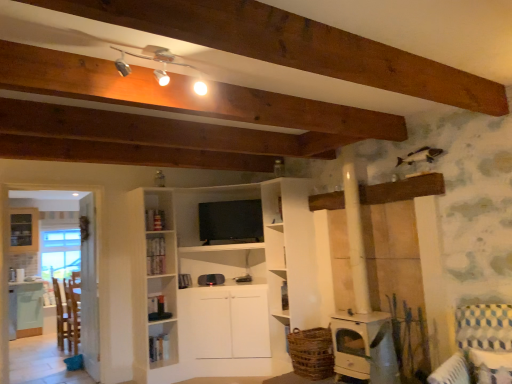
Question: Would you say wooden chair at left is inside or outside silver metallic track lights at upper center?

Choices:
 (A) inside
 (B) outside

Answer: (B)

Question: Looking at the image, does wooden chair at left seem bigger or smaller compared to silver metallic track lights at upper center?

Choices:
 (A) big
 (B) small

Answer: (A)

Question: Which object is positioned closest to the blue and white checkered fabric armchair at lower right?

Choices:
 (A) white matte wood stove at lower center
 (B) wooden chair at left
 (C) green matte table at lower left
 (D) transparent glass door at left
 (E) silver metallic track lights at upper center

Answer: (A)

Question: Which of these objects is positioned closest to the green matte table at lower left?

Choices:
 (A) blue and white checkered fabric armchair at lower right
 (B) silver metallic track lights at upper center
 (C) wooden chair at left
 (D) white matte wood stove at lower center
 (E) transparent glass door at left

Answer: (C)